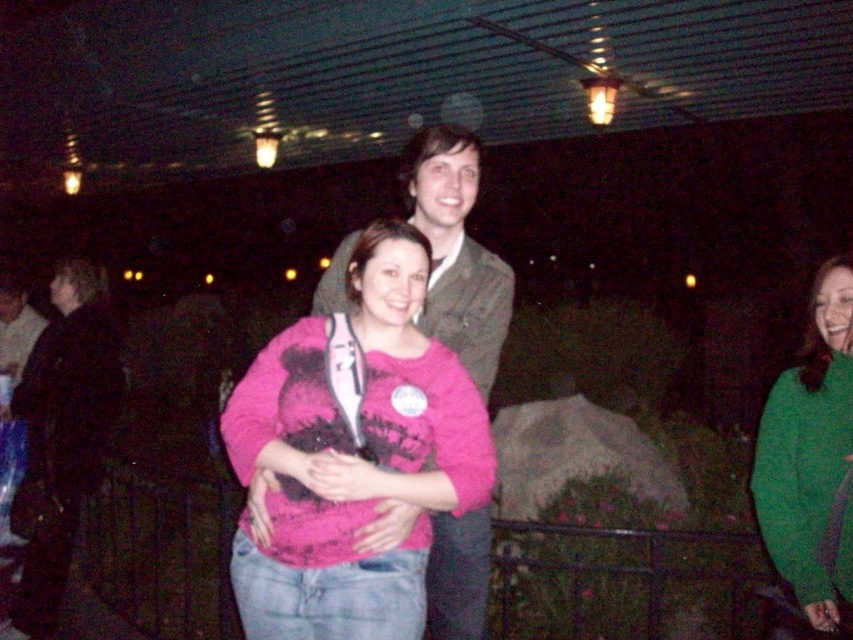
Locate an element on the screen. pink fleece sweater at center is located at coordinates (352, 454).

Is point (250, 396) in front of point (775, 452)?

Yes, point (250, 396) is in front of point (775, 452).

At what (x,y) coordinates should I click in order to perform the action: click on pink fleece sweater at center. Please return your answer as a coordinate pair (x, y). The width and height of the screenshot is (853, 640). Looking at the image, I should click on (352, 454).